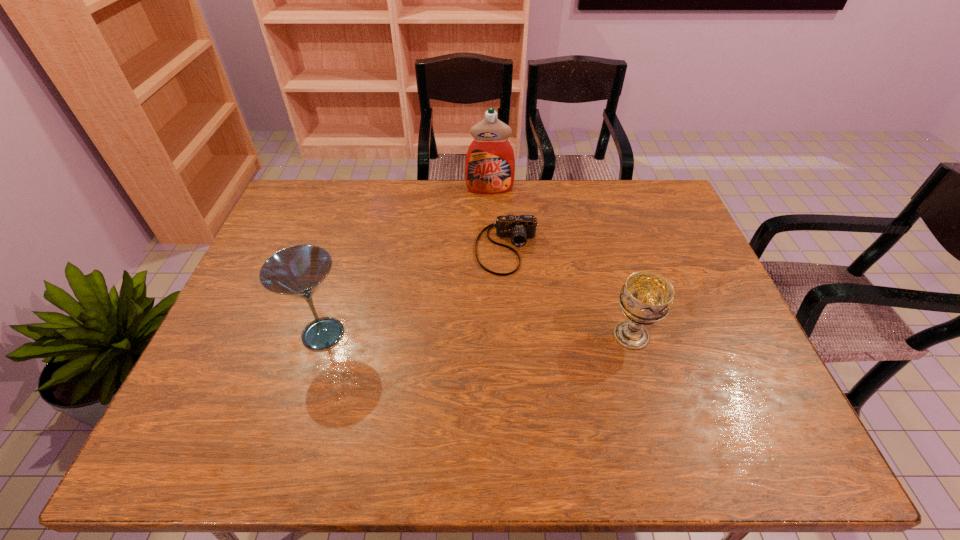
Identify the location of blank space located on the front surface of the tallest object. (492, 222).

Find the location of `free space located on the front surface of the tallest object`. free space located on the front surface of the tallest object is located at coordinates (492, 226).

Find the location of `vacant space situated on the front surface of the tallest object`. vacant space situated on the front surface of the tallest object is located at coordinates (493, 246).

You are a GUI agent. You are given a task and a screenshot of the screen. Output one action in this format:
    pyautogui.click(x=<x>, y=<y>)
    Task: Click on the vacant space situated on the front-facing side of the shortest object
    The image size is (960, 540).
    Given the screenshot: What is the action you would take?
    pyautogui.click(x=506, y=354)

Locate an element on the screen. The width and height of the screenshot is (960, 540). free location located on the front-facing side of the shortest object is located at coordinates (506, 347).

The height and width of the screenshot is (540, 960). I want to click on free space located on the front-facing side of the shortest object, so click(x=506, y=378).

Identify the location of object that is at the far edge. (490, 163).

Find the location of a particular element. The image size is (960, 540). vacant space at the far edge is located at coordinates (587, 180).

In the image, there is a desktop. In order to click on vacant space at the near edge in this screenshot , I will do `click(546, 383)`.

You are a GUI agent. You are given a task and a screenshot of the screen. Output one action in this format:
    pyautogui.click(x=<x>, y=<y>)
    Task: Click on the free space at the right edge of the desktop
    
    Given the screenshot: What is the action you would take?
    pyautogui.click(x=708, y=327)